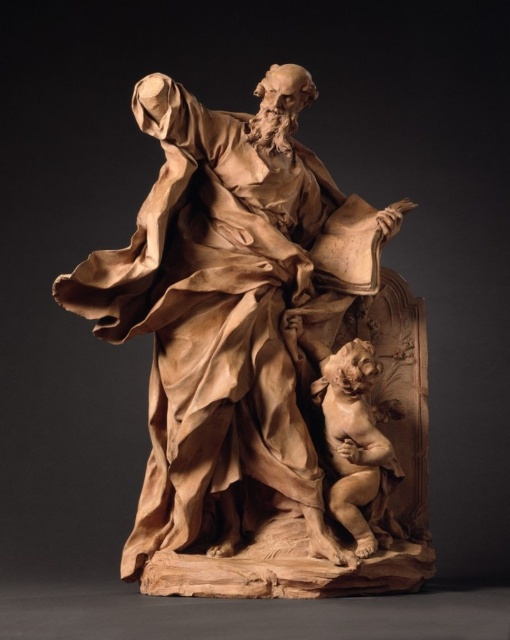
What do you see at coordinates (260, 358) in the screenshot?
I see `wooden statue at center` at bounding box center [260, 358].

Locate an element on the screen. This screenshot has width=510, height=640. wooden statue at center is located at coordinates (260, 358).

Identify the location of wooden statue at center. (260, 358).